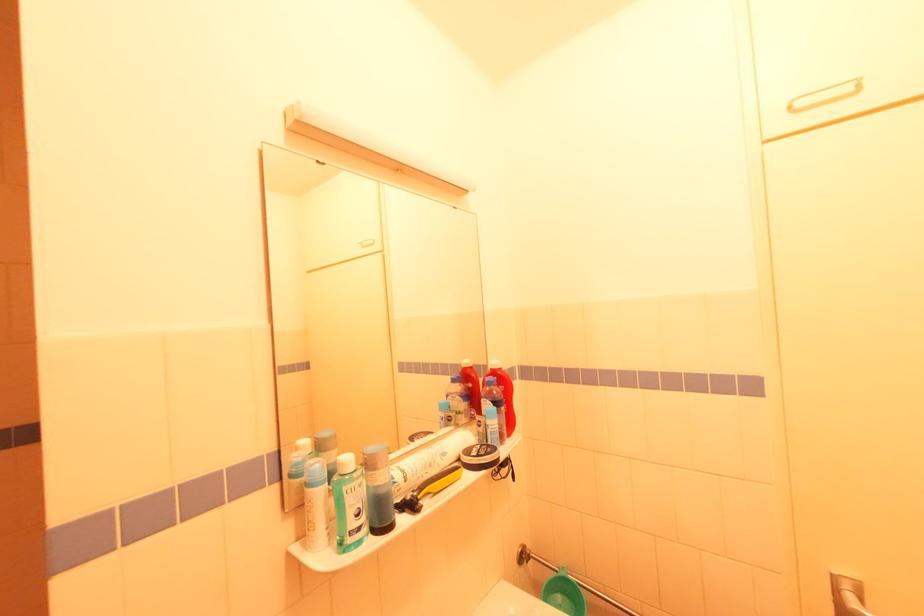
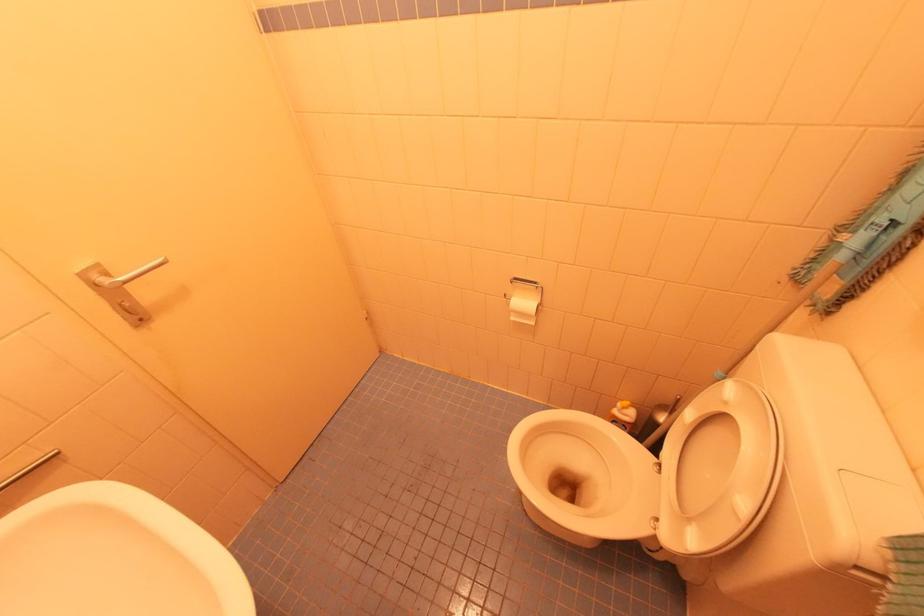
The images are taken continuously from a first-person perspective. In which direction is your viewpoint rotating?

The camera's rotation is toward right-down.